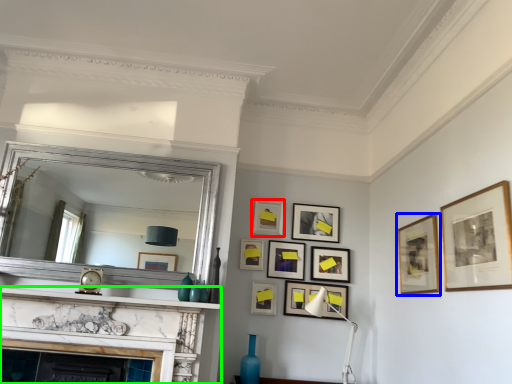
Question: Based on their relative distances, which object is farther from picture frame (highlighted by a red box)? Choose from picture frame (highlighted by a blue box) and fireplace (highlighted by a green box).

Choices:
 (A) picture frame
 (B) fireplace

Answer: (B)